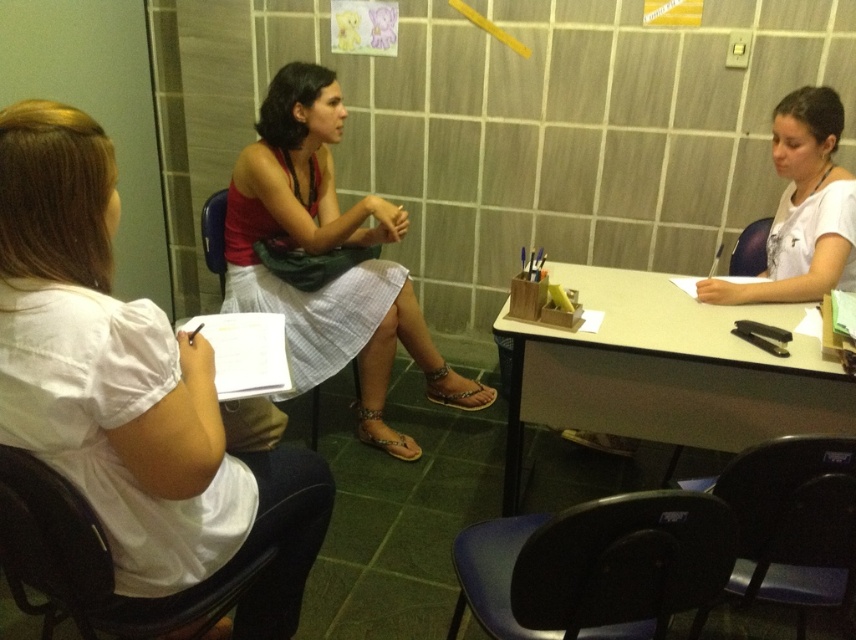
Question: From the image, what is the correct spatial relationship of black plastic chair at lower center in relation to black plastic chair at lower right?

Choices:
 (A) above
 (B) below

Answer: (A)

Question: Which object is closer to the camera taking this photo?

Choices:
 (A) black plastic chair at lower right
 (B) white matte shirt at right
 (C) matte red tank top at center

Answer: (A)

Question: Considering the real-world distances, which object is closest to the white cotton shirt at left?

Choices:
 (A) black plastic chair at lower left
 (B) blue plastic chair at center
 (C) black plastic chair at lower right
 (D) matte red tank top at center

Answer: (A)

Question: Can you confirm if matte red tank top at center is positioned to the left of blue plastic chair at center?

Choices:
 (A) yes
 (B) no

Answer: (B)

Question: Which object is closer to the camera taking this photo?

Choices:
 (A) black plastic chair at lower left
 (B) matte black chair at right
 (C) white cotton shirt at left
 (D) matte red tank top at center

Answer: (C)

Question: Does black plastic chair at lower left appear under matte black chair at right?

Choices:
 (A) yes
 (B) no

Answer: (A)